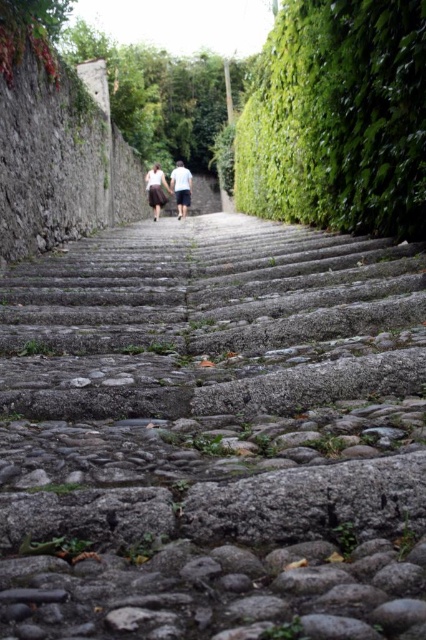
You are standing at the bottom of the staircase and see the gray stone stairs at center and the white cotton shirt at center. Which object is positioned to the right from your perspective?

The gray stone stairs at center are to the right of the white cotton shirt at center from your perspective.